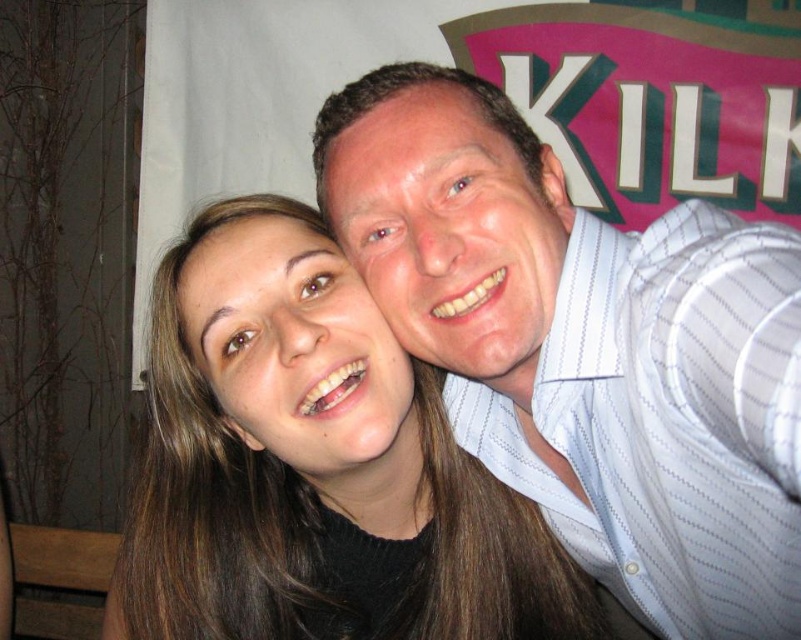
Between white striped shirt at upper right and brown hair at center, which one has less height?

brown hair at center

Locate an element on the screen. white striped shirt at upper right is located at coordinates (586, 346).

This screenshot has height=640, width=801. What do you see at coordinates (586, 346) in the screenshot?
I see `white striped shirt at upper right` at bounding box center [586, 346].

Where is `white striped shirt at upper right`? This screenshot has width=801, height=640. white striped shirt at upper right is located at coordinates (586, 346).